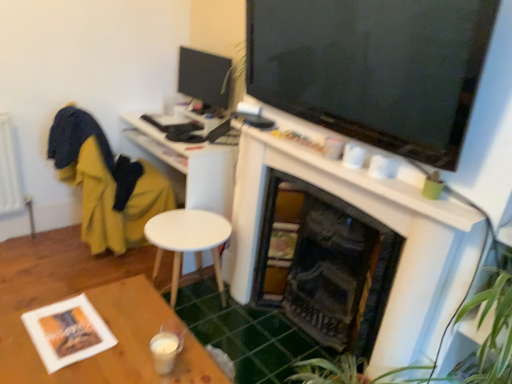
At what (x,y) coordinates should I click in order to perform the action: click on empty space that is ontop of wooden table at lower left (from a real-world perspective). Please return your answer as a coordinate pair (x, y). This screenshot has width=512, height=384. Looking at the image, I should click on (105, 336).